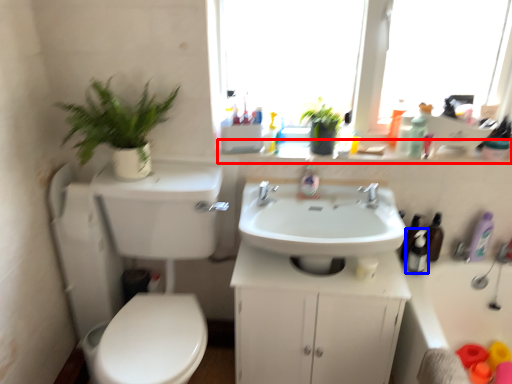
Question: Which object is closer to the camera taking this photo, window sill (highlighted by a red box) or toiletry (highlighted by a blue box)?

Choices:
 (A) window sill
 (B) toiletry

Answer: (B)